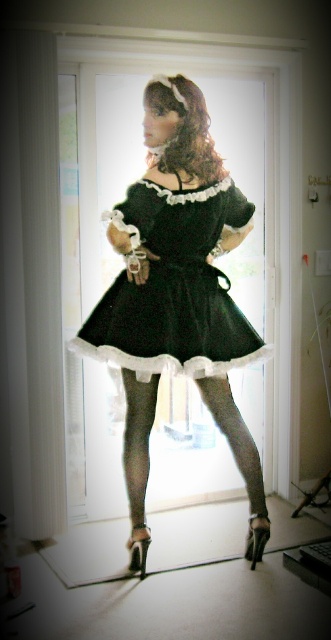
This screenshot has width=331, height=640. Find the location of `gray tights at center`. gray tights at center is located at coordinates (138, 440).

Does point (129, 467) lie in front of point (134, 561)?

Yes, point (129, 467) is in front of point (134, 561).

Between point (136, 518) and point (138, 554), which one is positioned in front?

Point (136, 518) is more forward.

You are a GUI agent. You are given a task and a screenshot of the screen. Output one action in this format:
    pyautogui.click(x=<x>, y=<y>)
    Task: Click on the gray tights at center
    
    Given the screenshot: What is the action you would take?
    pyautogui.click(x=138, y=440)

Who is shorter, gray tights at center or black satin stocking at lower center?

black satin stocking at lower center is shorter.

Is point (261, 513) positioned in front of point (264, 516)?

No, it is not.

What do you see at coordinates (138, 440) in the screenshot?
I see `gray tights at center` at bounding box center [138, 440].

Locate an element on the screen. The width and height of the screenshot is (331, 640). gray tights at center is located at coordinates (138, 440).

Does black velvet dress at center come in front of black sheer stocking at lower center?

That is True.

Looking at this image, how far apart are black velvet dress at center and black sheer stocking at lower center?

3.29 feet

In order to click on black velvet dress at center in this screenshot , I will do `click(174, 285)`.